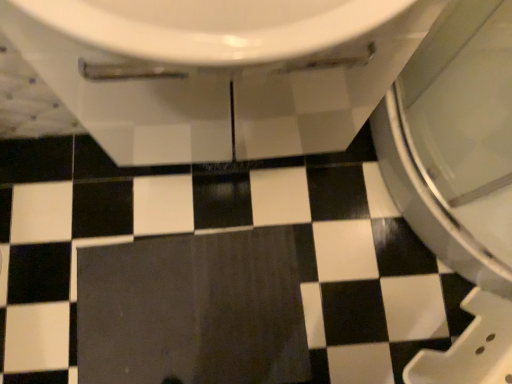
Question: Looking at their shapes, would you say white glossy toilet at upper center is wider or thinner than dark matte tile at center?

Choices:
 (A) wide
 (B) thin

Answer: (B)

Question: From the image's perspective, is white glossy toilet at upper center positioned above or below dark matte tile at center?

Choices:
 (A) below
 (B) above

Answer: (B)

Question: Considering their positions, is white glossy toilet at upper center located in front of or behind dark matte tile at center?

Choices:
 (A) behind
 (B) front

Answer: (B)

Question: From a real-world perspective, is dark matte tile at center positioned above or below white glossy toilet at upper center?

Choices:
 (A) below
 (B) above

Answer: (A)

Question: From their relative heights in the image, would you say dark matte tile at center is taller or shorter than white glossy toilet at upper center?

Choices:
 (A) tall
 (B) short

Answer: (B)

Question: From the image's perspective, relative to white glossy toilet at upper center, is dark matte tile at center above or below?

Choices:
 (A) below
 (B) above

Answer: (A)

Question: Is point (117, 332) closer or farther from the camera than point (254, 112)?

Choices:
 (A) closer
 (B) farther

Answer: (B)